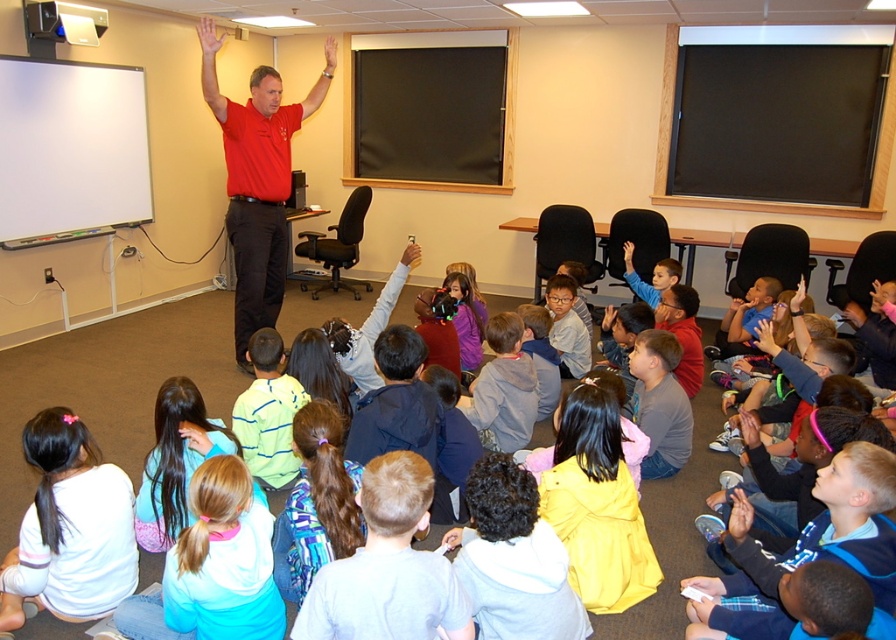
Does point (104, 486) come behind point (271, 522)?

Yes.

Can you confirm if white matte shirt at lower left is positioned below pink fabric hair tie at lower center?

Incorrect, white matte shirt at lower left is not positioned below pink fabric hair tie at lower center.

Which is behind, point (46, 573) or point (204, 561)?

Positioned behind is point (46, 573).

The image size is (896, 640). Find the location of `white matte shirt at lower left`. white matte shirt at lower left is located at coordinates (69, 529).

Which is more to the right, white matte shirt at lower left or light blue fleece jacket at lower left?

Positioned to the right is light blue fleece jacket at lower left.

Does white matte shirt at lower left appear under light blue fleece jacket at lower left?

Correct, white matte shirt at lower left is located below light blue fleece jacket at lower left.

Does point (24, 442) lie in front of point (194, 388)?

Yes, it is.

Locate an element on the screen. This screenshot has width=896, height=640. white matte shirt at lower left is located at coordinates (69, 529).

Who is more forward, (270, 76) or (658, 298)?

Point (270, 76) is more forward.

Does matte red shirt at center have a larger size compared to light blue shirt at center?

Yes, matte red shirt at center is bigger than light blue shirt at center.

Locate an element on the screen. matte red shirt at center is located at coordinates (257, 180).